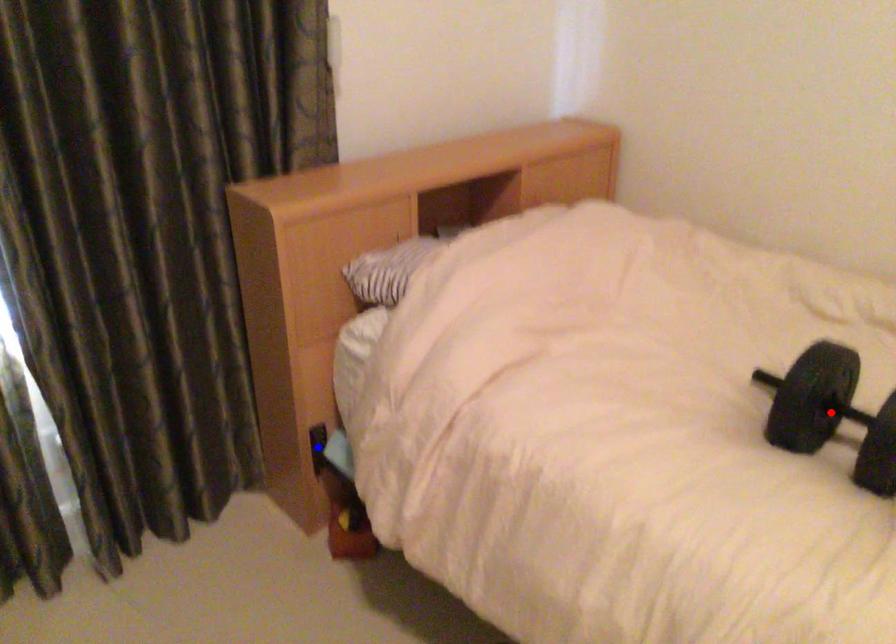
Question: Which of the two points in the image is closer to the camera?

Choices:
 (A) Blue point is closer.
 (B) Red point is closer.

Answer: (B)